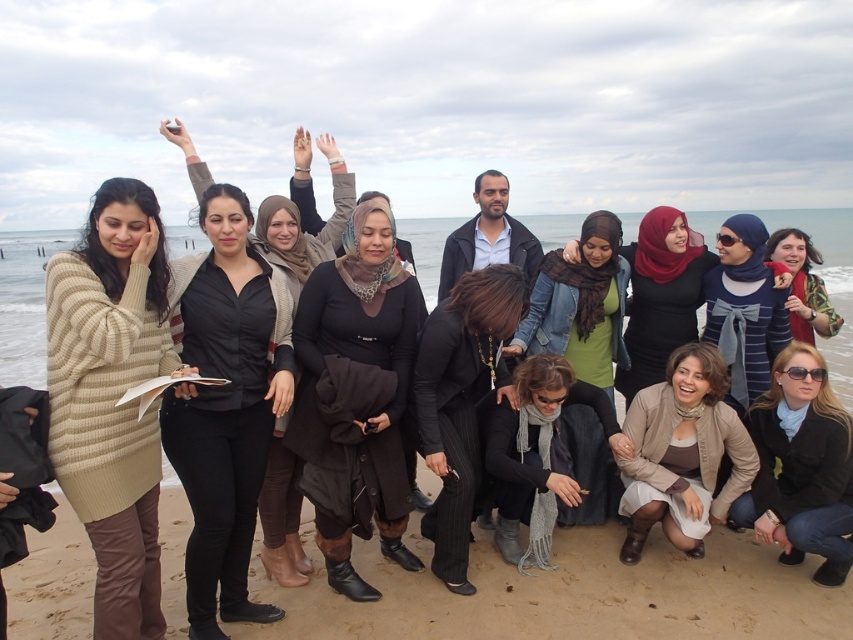
Question: Which point is closer to the camera taking this photo?

Choices:
 (A) (798, 268)
 (B) (837, 541)
 (C) (474, 378)

Answer: (B)

Question: Does black matte coat at center appear under black pinstripe pants at center?

Choices:
 (A) yes
 (B) no

Answer: (B)

Question: Is sunglasses fabric scarf at lower right to the left of green jersey at center from the viewer's perspective?

Choices:
 (A) yes
 (B) no

Answer: (B)

Question: Observing the image, what is the correct spatial positioning of green jersey at center in reference to blue striped sweater at center?

Choices:
 (A) below
 (B) above

Answer: (A)

Question: Which object is the closest to the matte black hijab at center?

Choices:
 (A) sunglasses fabric scarf at lower right
 (B) red scarf at right
 (C) beige knitted sweater at left

Answer: (B)

Question: Which object appears closest to the camera in this image?

Choices:
 (A) red scarf at right
 (B) green jersey at center
 (C) black pinstripe pants at center

Answer: (C)